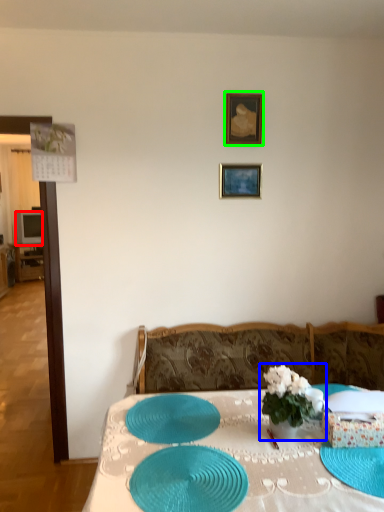
Question: Based on their relative distances, which object is nearer to television (highlighted by a red box)? Choose from houseplant (highlighted by a blue box) and picture frame (highlighted by a green box).

Choices:
 (A) houseplant
 (B) picture frame

Answer: (B)